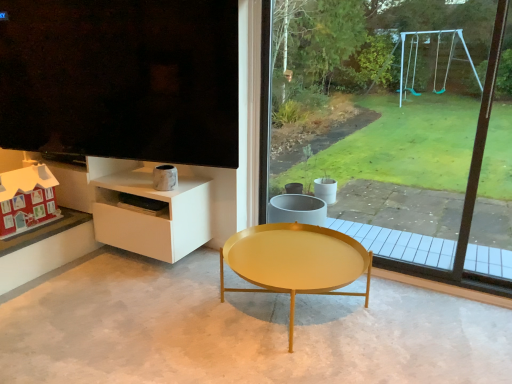
Image resolution: width=512 pixels, height=384 pixels. In order to click on free space in front of gold metallic coffee table at center in this screenshot , I will do `click(297, 363)`.